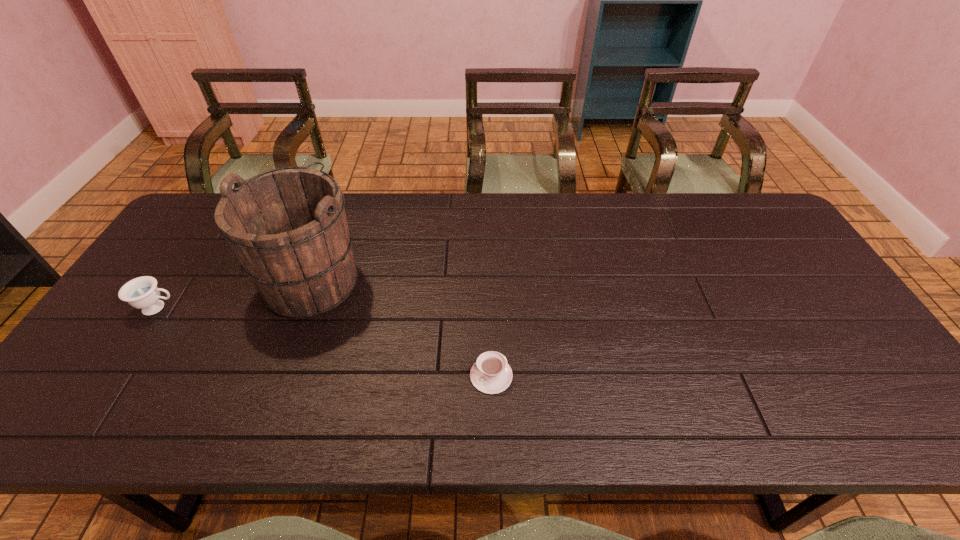
Locate an element on the screen. This screenshot has height=540, width=960. vacant area that lies between the second object from left to right and the right teacup is located at coordinates (402, 328).

Locate an element on the screen. vacant space in between the second object from right to left and the nearest object is located at coordinates (402, 328).

Find the location of a particular element. free area in between the rightmost object and the farther teacup is located at coordinates (324, 342).

At what (x,y) coordinates should I click in order to perform the action: click on free area in between the left teacup and the tallest object. Please return your answer as a coordinate pair (x, y). Image resolution: width=960 pixels, height=540 pixels. Looking at the image, I should click on (235, 294).

Locate an element on the screen. This screenshot has height=540, width=960. free space between the rightmost object and the bucket is located at coordinates (402, 328).

Identify the location of free space between the tallest object and the right teacup. Image resolution: width=960 pixels, height=540 pixels. (402, 328).

Where is `empty space between the shortest object and the second object from right to left`? The height and width of the screenshot is (540, 960). empty space between the shortest object and the second object from right to left is located at coordinates (402, 328).

Find the location of a particular element. This screenshot has height=540, width=960. object that is the closest one to the shortest object is located at coordinates (287, 226).

Find the location of a particular element. This screenshot has height=540, width=960. object that can be found as the second closest to the nearest object is located at coordinates (142, 293).